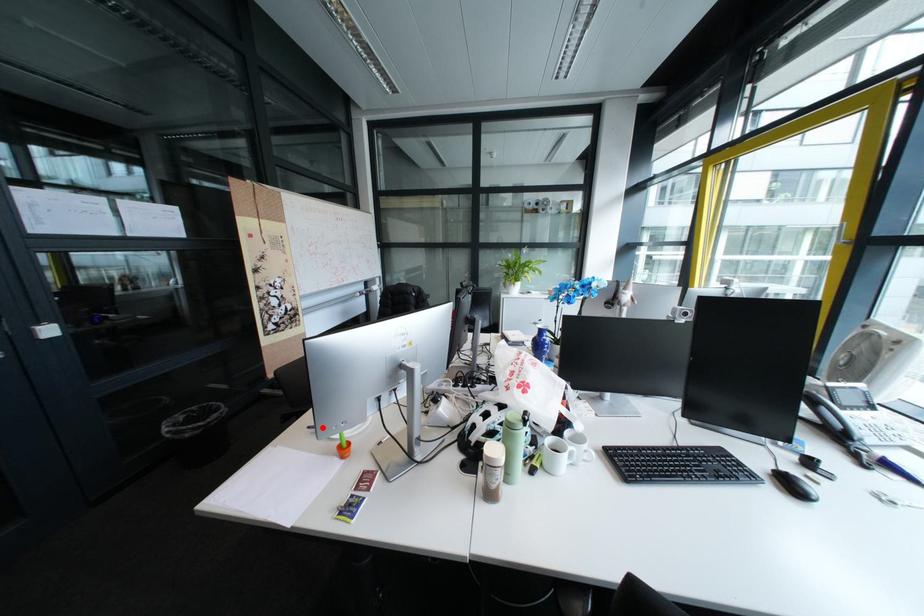
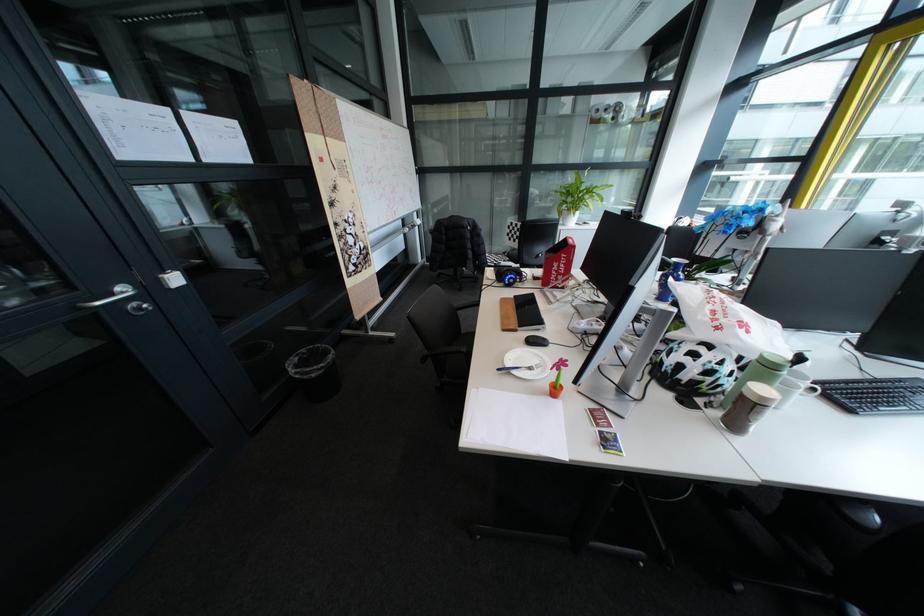
Question: I am providing you with two images of the same scene from different viewpoints. Image1 has a red point marked. In image2, the corresponding 3D location appears at what relative position? Reply with the corresponding letter.

Choices:
 (A) Closer
 (B) Farther

Answer: (A)